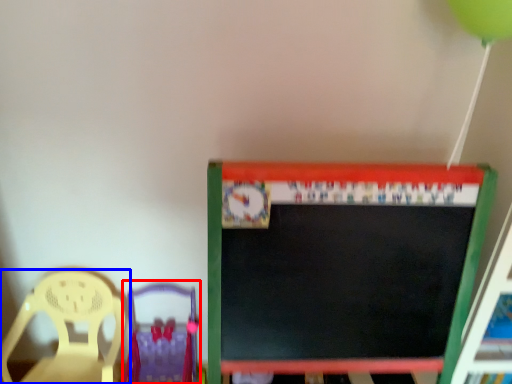
Question: Which object is closer to the camera taking this photo, chair (highlighted by a red box) or chair (highlighted by a blue box)?

Choices:
 (A) chair
 (B) chair

Answer: (B)